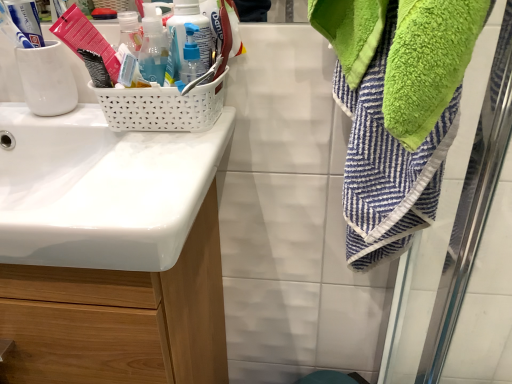
Question: Considering the positions of translucent plastic pump bottle at upper center, positioned as the 2th bottle in right-to-left order, and white glossy sink at left in the image, is translucent plastic pump bottle at upper center, positioned as the 2th bottle in right-to-left order, wider or thinner than white glossy sink at left?

Choices:
 (A) thin
 (B) wide

Answer: (A)

Question: From the image's perspective, is translucent plastic pump bottle at upper center, positioned as the 2th bottle in right-to-left order, located above or below white glossy sink at left?

Choices:
 (A) below
 (B) above

Answer: (B)

Question: Which object is positioned closest to the white glossy sink at left?

Choices:
 (A) translucent plastic pump bottle at center, placed as the 3th bottle when sorted from left to right
 (B) translucent plastic pump bottle at upper center, positioned as the 2th bottle in right-to-left order
 (C) translucent plastic soap dispenser at upper left, which ranks as the 3th bottle in right-to-left order

Answer: (C)

Question: Which of these objects is positioned closest to the translucent plastic soap dispenser at upper left, which ranks as the 3th bottle in right-to-left order?

Choices:
 (A) translucent plastic pump bottle at center, placed as the 3th bottle when sorted from left to right
 (B) white glossy sink at left
 (C) translucent plastic pump bottle at upper center, acting as the second bottle starting from the left

Answer: (C)